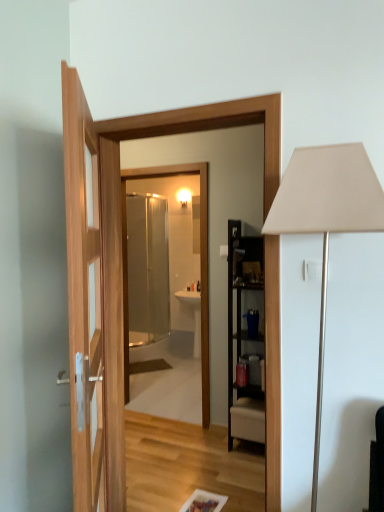
Question: From a real-world perspective, is transparent glass mirror at center located higher than white matte table lamp at right?

Choices:
 (A) no
 (B) yes

Answer: (A)

Question: Is transparent glass mirror at center positioned with its back to white matte table lamp at right?

Choices:
 (A) yes
 (B) no

Answer: (B)

Question: Could white matte table lamp at right be considered to be inside transparent glass mirror at center?

Choices:
 (A) no
 (B) yes

Answer: (A)

Question: Is transparent glass mirror at center located outside white matte table lamp at right?

Choices:
 (A) no
 (B) yes

Answer: (B)

Question: From the image's perspective, is transparent glass mirror at center on white matte table lamp at right?

Choices:
 (A) yes
 (B) no

Answer: (A)

Question: Is transparent glass mirror at center spatially inside white matte table lamp at right, or outside of it?

Choices:
 (A) inside
 (B) outside

Answer: (B)

Question: From a real-world perspective, relative to white matte table lamp at right, is transparent glass mirror at center vertically above or below?

Choices:
 (A) below
 (B) above

Answer: (A)

Question: Does point (203, 392) appear closer or farther from the camera than point (294, 183)?

Choices:
 (A) farther
 (B) closer

Answer: (A)

Question: Considering the relative positions of transparent glass mirror at center and white matte table lamp at right in the image provided, is transparent glass mirror at center to the left or to the right of white matte table lamp at right?

Choices:
 (A) left
 (B) right

Answer: (A)

Question: Is white matte table lamp at right spatially inside clear glass shower door at center, or outside of it?

Choices:
 (A) inside
 (B) outside

Answer: (B)

Question: From their relative heights in the image, would you say white matte table lamp at right is taller or shorter than clear glass shower door at center?

Choices:
 (A) tall
 (B) short

Answer: (B)

Question: Based on their sizes in the image, would you say white matte table lamp at right is bigger or smaller than clear glass shower door at center?

Choices:
 (A) small
 (B) big

Answer: (A)

Question: Considering the positions of white matte table lamp at right and clear glass shower door at center in the image, is white matte table lamp at right wider or thinner than clear glass shower door at center?

Choices:
 (A) wide
 (B) thin

Answer: (B)

Question: Is transparent glass mirror at center wider or thinner than clear glass shower door at center?

Choices:
 (A) thin
 (B) wide

Answer: (A)

Question: Considering their positions, is transparent glass mirror at center located in front of or behind clear glass shower door at center?

Choices:
 (A) front
 (B) behind

Answer: (A)